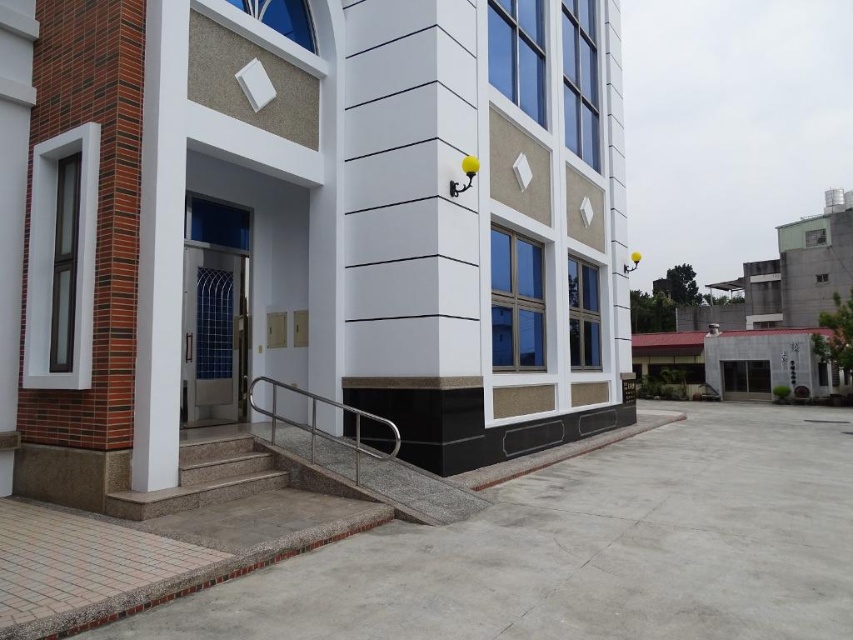
Question: Can you confirm if granite steps at lower left is wider than stainless steel door at center?

Choices:
 (A) no
 (B) yes

Answer: (B)

Question: Can you confirm if granite steps at lower left is positioned to the right of satin silver railing at lower center?

Choices:
 (A) no
 (B) yes

Answer: (A)

Question: Which of the following is the closest to the observer?

Choices:
 (A) (194, 225)
 (B) (393, 449)
 (C) (363, 497)

Answer: (C)

Question: Which of the following is the closest to the observer?

Choices:
 (A) white glossy wall lamp at center
 (B) granite steps at lower left
 (C) stainless steel door at center

Answer: (B)

Question: Among these points, which one is farthest from the camera?

Choices:
 (A) (238, 324)
 (B) (114, 512)
 (C) (364, 269)

Answer: (A)

Question: Does white glossy wall lamp at center appear on the right side of stainless steel door at center?

Choices:
 (A) no
 (B) yes

Answer: (B)